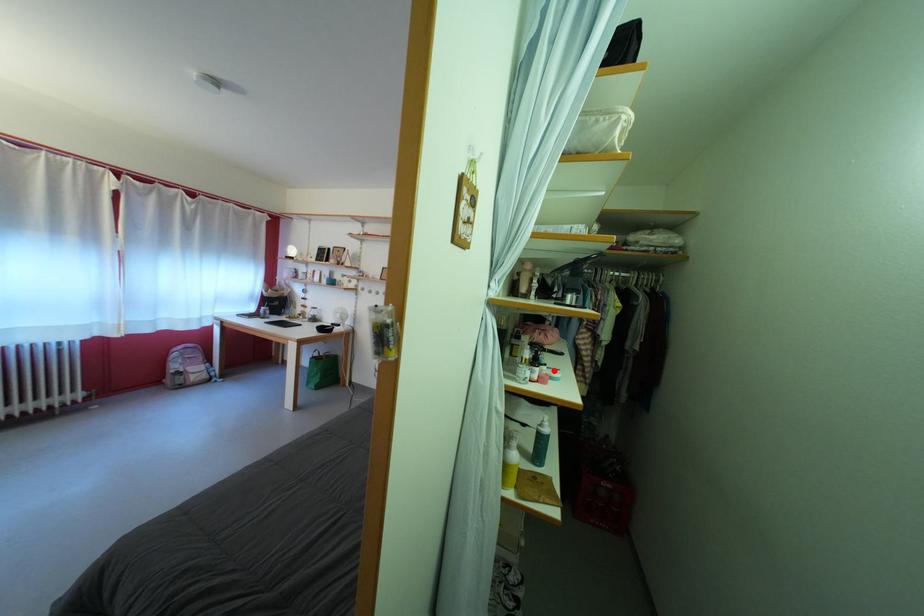
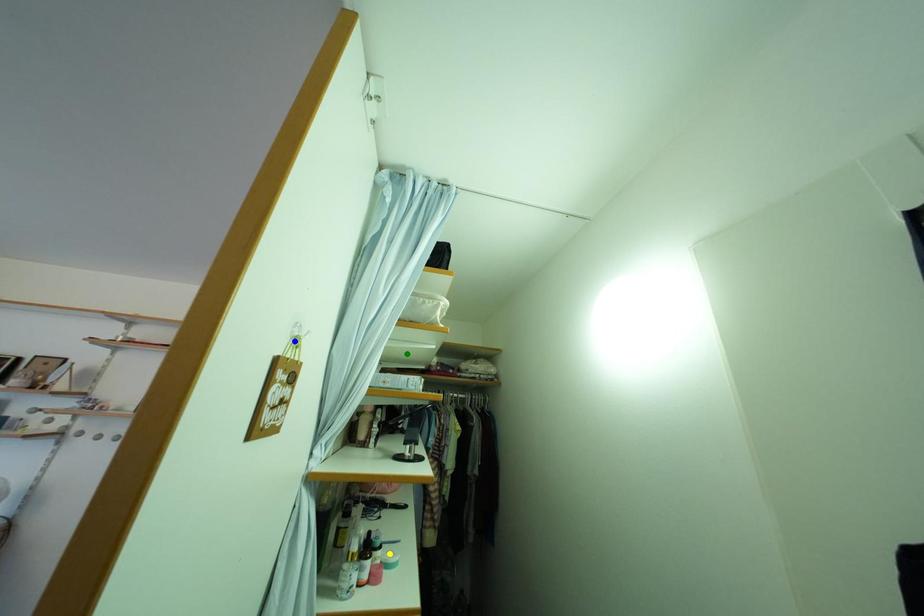
Question: I am providing you with two images of the same scene from different viewpoints. A red point is marked on the first image. You are given multiple points on the second image. In image 2, which mark is for the same physical point as the one in image 1?

Choices:
 (A) green point
 (B) blue point
 (C) yellow point

Answer: (C)